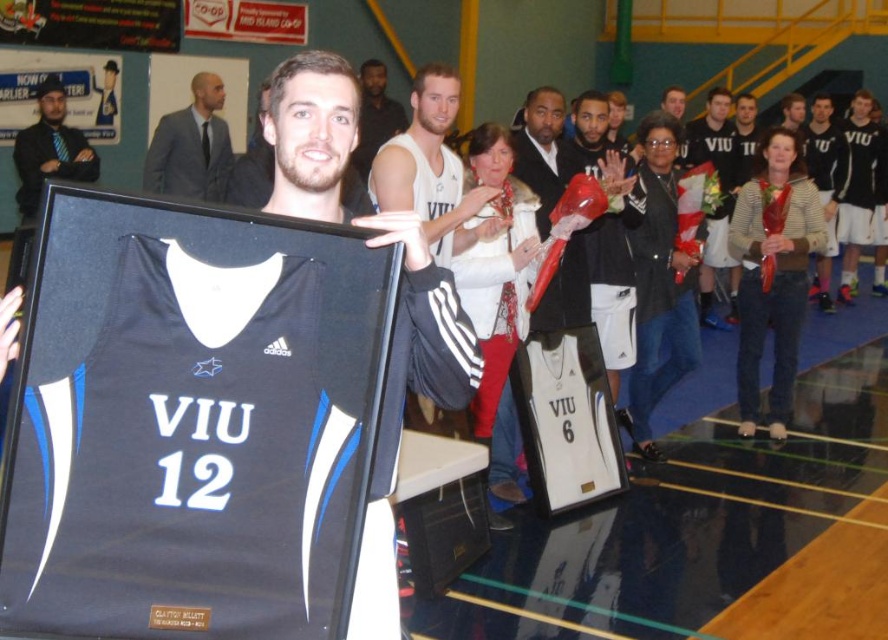
Who is more distant from viewer, [194,116] or [88,163]?

Positioned behind is point [88,163].

Does point (175, 192) lie in front of point (70, 156)?

Yes, it is.

The image size is (888, 640). Find the location of `matte black suit at upper left`. matte black suit at upper left is located at coordinates (191, 145).

Can you confirm if matte black suit at upper left is wider than matte white jersey at center?

Indeed, matte black suit at upper left has a greater width compared to matte white jersey at center.

Between matte black suit at upper left and matte white jersey at center, which one has more height?

Standing taller between the two is matte white jersey at center.

Identify the location of matte black suit at upper left. The width and height of the screenshot is (888, 640). coord(191,145).

Who is positioned more to the left, white jersey at center or matte white jersey at center?

Positioned to the left is matte white jersey at center.

Image resolution: width=888 pixels, height=640 pixels. What do you see at coordinates (431, 170) in the screenshot?
I see `white jersey at center` at bounding box center [431, 170].

Which is behind, point (461, 189) or point (377, 83)?

The point (377, 83) is more distant.

Where is `white jersey at center`? The image size is (888, 640). white jersey at center is located at coordinates (431, 170).